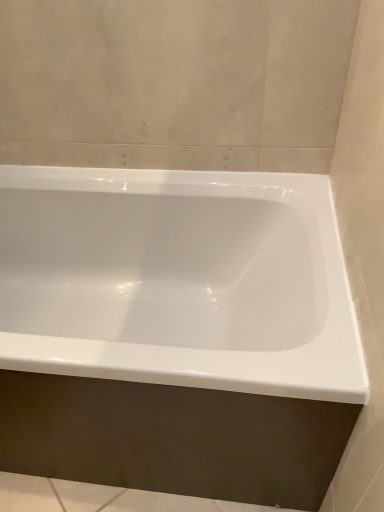
What do you see at coordinates (178, 280) in the screenshot?
I see `white glossy bathtub at center` at bounding box center [178, 280].

Find the location of `white glossy bathtub at center`. white glossy bathtub at center is located at coordinates (178, 280).

Where is `white glossy bathtub at center`? white glossy bathtub at center is located at coordinates (178, 280).